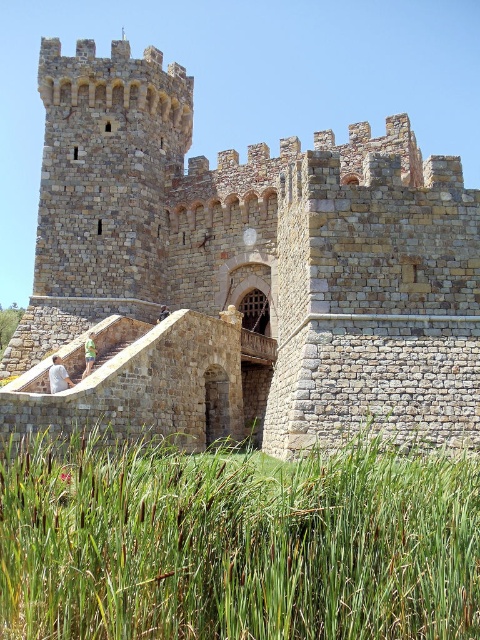
Does brown stone castle at center have a greater height compared to green grass at lower center?

Correct, brown stone castle at center is much taller as green grass at lower center.

Can you confirm if brown stone castle at center is bigger than green grass at lower center?

Indeed, brown stone castle at center has a larger size compared to green grass at lower center.

Does point (237, 353) come closer to viewer compared to point (15, 568)?

No.

This screenshot has height=640, width=480. What are the coordinates of `brown stone castle at center` in the screenshot? It's located at (243, 272).